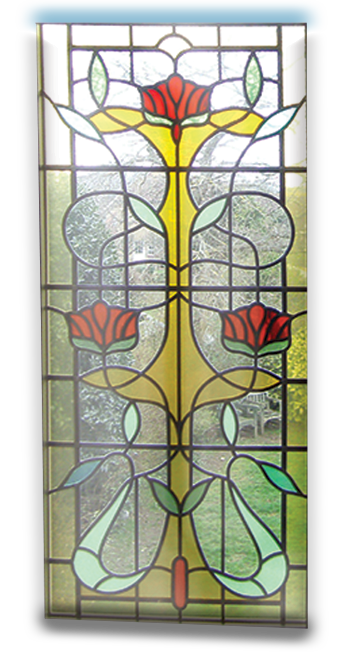
Identify the location of shadow of stained glass window. Image resolution: width=347 pixels, height=662 pixels. (178, 634).